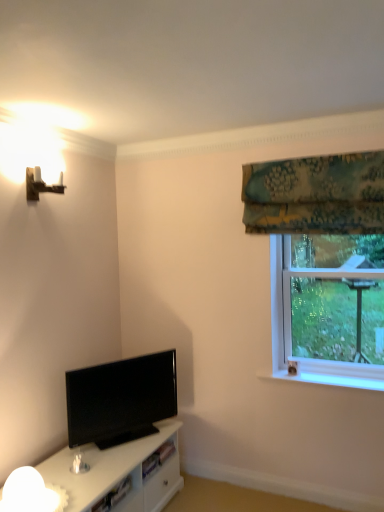
Measure the distance between point (291, 168) and camera.

Point (291, 168) and camera are 8.51 feet apart.

This screenshot has width=384, height=512. Describe the element at coordinates (338, 319) in the screenshot. I see `transparent glass window at upper right` at that location.

What do you see at coordinates (40, 184) in the screenshot? I see `wooden wall sconce at upper left` at bounding box center [40, 184].

Identify the location of black glossy tv at lower left. The image size is (384, 512). (120, 399).

The height and width of the screenshot is (512, 384). What do you see at coordinates (120, 399) in the screenshot?
I see `black glossy tv at lower left` at bounding box center [120, 399].

Identify the location of white frosted glass lamp at lower left. (31, 493).

Locate an element on the screen. green floral fabric at upper right is located at coordinates (316, 195).

Is wooden wall sconce at upper left not close to transparent glass window at upper right?

wooden wall sconce at upper left is positioned a significant distance from transparent glass window at upper right.

Can you tell me how much wooden wall sconce at upper left and transparent glass window at upper right differ in facing direction?

The facing directions of wooden wall sconce at upper left and transparent glass window at upper right are 86.9 degrees apart.

Locate an element on the screen. This screenshot has width=384, height=512. window screen below the wooden wall sconce at upper left (from the image's perspective) is located at coordinates (338, 319).

Is wooden wall sconce at upper left in front of or behind transparent glass window at upper right in the image?

Visually, wooden wall sconce at upper left is located in front of transparent glass window at upper right.

From a real-world perspective, which is physically below, white frosted glass lamp at lower left or black glossy tv at lower left?

white frosted glass lamp at lower left, from a real-world perspective.

Is white frosted glass lamp at lower left positioned with its back to black glossy tv at lower left?

No, white frosted glass lamp at lower left is not facing the opposite direction of black glossy tv at lower left.

Who is more distant, white frosted glass lamp at lower left or black glossy tv at lower left?

black glossy tv at lower left is more distant.

Is white frosted glass lamp at lower left directly adjacent to black glossy tv at lower left?

No, white frosted glass lamp at lower left is not with black glossy tv at lower left.

Between transparent glass window at upper right and white frosted glass lamp at lower left, which one appears on the right side from the viewer's perspective?

transparent glass window at upper right.

Is transparent glass window at upper right aimed at white frosted glass lamp at lower left?

No, transparent glass window at upper right is not facing towards white frosted glass lamp at lower left.

From a real-world perspective, which is physically below, transparent glass window at upper right or white frosted glass lamp at lower left?

From a 3D spatial view, white frosted glass lamp at lower left is below.

From the image's perspective, does transparent glass window at upper right appear lower than white frosted glass lamp at lower left?

No.

Who is shorter, green floral fabric at upper right or transparent glass window at upper right?

With less height is green floral fabric at upper right.

Which object is positioned more to the right, green floral fabric at upper right or transparent glass window at upper right?

transparent glass window at upper right.

Do you think green floral fabric at upper right is within transparent glass window at upper right, or outside of it?

The correct answer is: outside.

Considering the points (297, 174) and (363, 321), which point is behind, point (297, 174) or point (363, 321)?

The point (363, 321) is behind.

From the image's perspective, is transparent glass window at upper right above or below black glossy tv at lower left?

Clearly, from the image's perspective, transparent glass window at upper right is above black glossy tv at lower left.

Can you tell me how much transparent glass window at upper right and black glossy tv at lower left differ in facing direction?

58.8 degrees separate the facing orientations of transparent glass window at upper right and black glossy tv at lower left.

Choose the correct answer: Is transparent glass window at upper right inside black glossy tv at lower left or outside it?

transparent glass window at upper right lies outside black glossy tv at lower left.

Considering the relative sizes of transparent glass window at upper right and black glossy tv at lower left in the image provided, is transparent glass window at upper right shorter than black glossy tv at lower left?

No.

From the image's perspective, which one is positioned lower, wooden wall sconce at upper left or white frosted glass lamp at lower left?

From the image's view, white frosted glass lamp at lower left is below.

Consider the image. Is wooden wall sconce at upper left oriented away from white frosted glass lamp at lower left?

That's not correct — wooden wall sconce at upper left is not looking away from white frosted glass lamp at lower left.

Find the location of a particular element. This screenshot has height=512, width=384. table lamp above the white frosted glass lamp at lower left (from a real-world perspective) is located at coordinates (40, 184).

Between black glossy tv at lower left and green floral fabric at upper right, which one appears on the right side from the viewer's perspective?

green floral fabric at upper right is more to the right.

Does point (75, 421) appear closer or farther from the camera than point (311, 189)?

Clearly, point (75, 421) is closer to the camera than point (311, 189).

Is black glossy tv at lower left thinner than green floral fabric at upper right?

Yes, black glossy tv at lower left is thinner than green floral fabric at upper right.

Image resolution: width=384 pixels, height=512 pixels. Find the location of `window screen below the wooden wall sconce at upper left (from the image's perspective)`. window screen below the wooden wall sconce at upper left (from the image's perspective) is located at coordinates (338, 319).

The height and width of the screenshot is (512, 384). I want to click on television behind the white frosted glass lamp at lower left, so click(x=120, y=399).

Looking at the image, which one is located closer to black glossy tv at lower left, wooden wall sconce at upper left or transparent glass window at upper right?

The object closer to black glossy tv at lower left is transparent glass window at upper right.

When comparing their distances from white frosted glass lamp at lower left, does black glossy tv at lower left or green floral fabric at upper right seem further?

green floral fabric at upper right lies further to white frosted glass lamp at lower left than the other object.

Which object lies further to the anchor point green floral fabric at upper right, transparent glass window at upper right or black glossy tv at lower left?

Among the two, black glossy tv at lower left is located further to green floral fabric at upper right.

Looking at the image, which one is located further to transparent glass window at upper right, wooden wall sconce at upper left or white frosted glass lamp at lower left?

Among the two, wooden wall sconce at upper left is located further to transparent glass window at upper right.

Estimate the real-world distances between objects in this image. Which object is closer to black glossy tv at lower left, green floral fabric at upper right or wooden wall sconce at upper left?

wooden wall sconce at upper left.

From the image, which object appears to be farther from white frosted glass lamp at lower left, wooden wall sconce at upper left or green floral fabric at upper right?

green floral fabric at upper right is positioned further to the anchor white frosted glass lamp at lower left.

Looking at the image, which one is located further to transparent glass window at upper right, green floral fabric at upper right or black glossy tv at lower left?

Based on the image, black glossy tv at lower left appears to be further to transparent glass window at upper right.

Consider the image. From the image, which object appears to be farther from black glossy tv at lower left, transparent glass window at upper right or white frosted glass lamp at lower left?

transparent glass window at upper right.

This screenshot has width=384, height=512. I want to click on television between white frosted glass lamp at lower left and transparent glass window at upper right, so pyautogui.click(x=120, y=399).

Where is `curtain situated between wooden wall sconce at upper left and transparent glass window at upper right from left to right`? curtain situated between wooden wall sconce at upper left and transparent glass window at upper right from left to right is located at coordinates (316, 195).

Find the location of a particular element. This screenshot has width=384, height=512. television between green floral fabric at upper right and white frosted glass lamp at lower left in the vertical direction is located at coordinates (120, 399).

Locate an element on the screen. Image resolution: width=384 pixels, height=512 pixels. lamp between wooden wall sconce at upper left and green floral fabric at upper right in the horizontal direction is located at coordinates (31, 493).